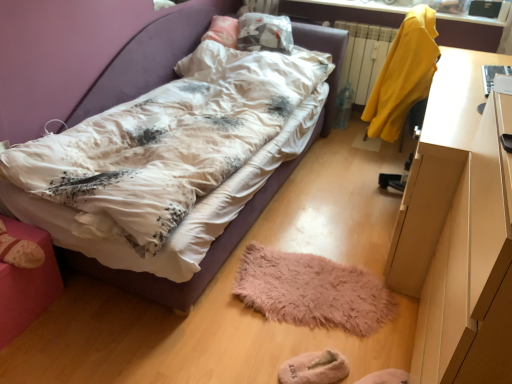
Question: In the image, is pink suede shoe at lower left positioned in front of or behind matte white bed at center?

Choices:
 (A) behind
 (B) front

Answer: (A)

Question: Based on their positions, is pink suede shoe at lower left located to the left or right of matte white bed at center?

Choices:
 (A) right
 (B) left

Answer: (B)

Question: Estimate the real-world distances between objects in this image. Which object is farther from the white glossy desk at right?

Choices:
 (A) yellow fabric at upper right
 (B) fuzzy pink mat at center
 (C) beige fuzzy slippers at lower center
 (D) yellow fabric coat at upper right
 (E) matte white bed at center

Answer: (E)

Question: Considering the real-world distances, which object is farthest from the matte white bed at center?

Choices:
 (A) fuzzy pink mat at center
 (B) yellow fabric at upper right
 (C) white glossy desk at right
 (D) pink suede shoe at lower left
 (E) yellow fabric coat at upper right

Answer: (C)